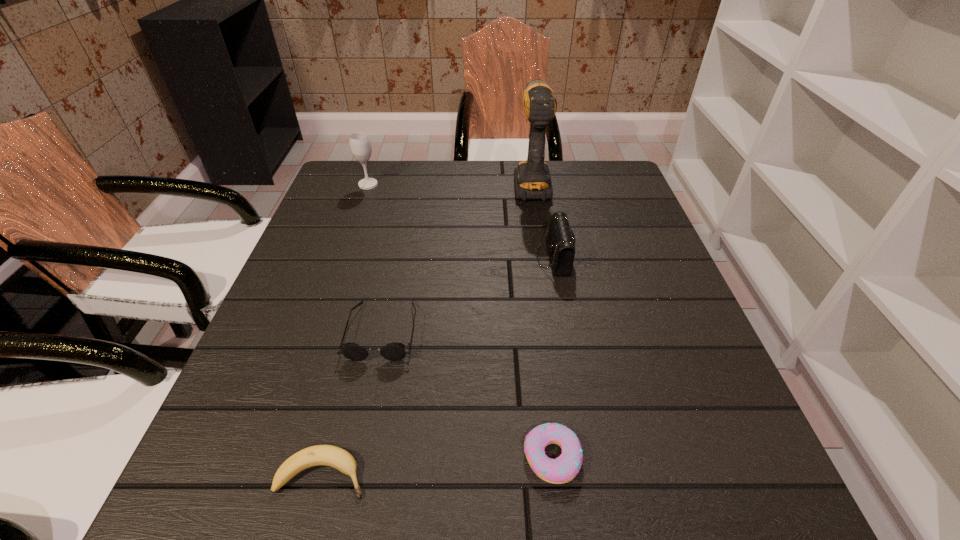
Find the location of a particular element. the tallest object is located at coordinates (532, 179).

The height and width of the screenshot is (540, 960). What are the coordinates of `wineglass` in the screenshot? It's located at (360, 145).

Find the location of a particular element. the fourth nearest object is located at coordinates (561, 240).

Find the location of a particular element. the fourth shortest object is located at coordinates (561, 240).

Identify the location of sunglasses. (395, 351).

The image size is (960, 540). Identify the location of the fourth tallest object. (395, 351).

Identify the location of doughnut. The height and width of the screenshot is (540, 960). (563, 469).

The width and height of the screenshot is (960, 540). I want to click on banana, so click(x=327, y=455).

Identify the location of vacant region located on the back of the wineglass. (374, 166).

The image size is (960, 540). I want to click on vacant space located on the front flap of the clutch bag, so [411, 258].